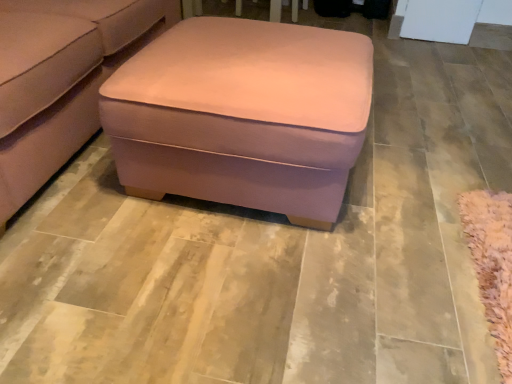
Question: From a real-world perspective, is suede-like pink ottoman at center positioned above or below pink fabric ottoman at center?

Choices:
 (A) below
 (B) above

Answer: (B)

Question: Relative to pink fabric ottoman at center, is suede-like pink ottoman at center in front or behind?

Choices:
 (A) front
 (B) behind

Answer: (A)

Question: In terms of width, does suede-like pink ottoman at center look wider or thinner when compared to pink fabric ottoman at center?

Choices:
 (A) wide
 (B) thin

Answer: (A)

Question: Considering the positions of pink fabric ottoman at center and suede-like pink ottoman at center in the image, is pink fabric ottoman at center bigger or smaller than suede-like pink ottoman at center?

Choices:
 (A) big
 (B) small

Answer: (B)

Question: Looking at their shapes, would you say pink fabric ottoman at center is wider or thinner than suede-like pink ottoman at center?

Choices:
 (A) wide
 (B) thin

Answer: (B)

Question: From the image's perspective, is pink fabric ottoman at center above or below suede-like pink ottoman at center?

Choices:
 (A) below
 (B) above

Answer: (A)

Question: Relative to suede-like pink ottoman at center, is pink fabric ottoman at center in front or behind?

Choices:
 (A) front
 (B) behind

Answer: (B)